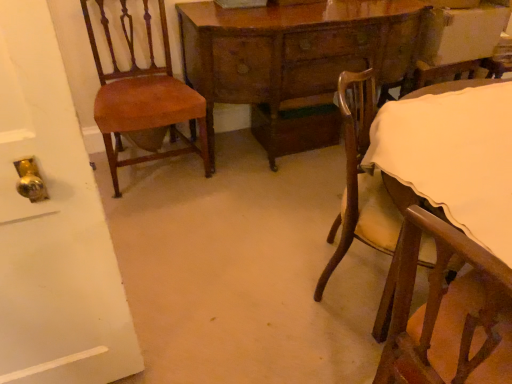
Question: Can you confirm if mahogany wood chair at left, which ranks as the 2th chair in right-to-left order, is positioned to the right of wooden table at center?

Choices:
 (A) yes
 (B) no

Answer: (B)

Question: From the image's perspective, would you say mahogany wood chair at left, which ranks as the 2th chair in right-to-left order, is shown under wooden table at center?

Choices:
 (A) no
 (B) yes

Answer: (B)

Question: Could you tell me if mahogany wood chair at left, which ranks as the 2th chair in right-to-left order, is facing wooden table at center?

Choices:
 (A) yes
 (B) no

Answer: (B)

Question: Does mahogany wood chair at left, which ranks as the first chair in left-to-right order, have a larger size compared to wooden table at center?

Choices:
 (A) no
 (B) yes

Answer: (A)

Question: Is mahogany wood chair at left, which ranks as the first chair in left-to-right order, thinner than wooden table at center?

Choices:
 (A) no
 (B) yes

Answer: (B)

Question: In terms of width, does mahogany wood chair at left, which ranks as the 2th chair in right-to-left order, look wider or thinner when compared to wooden chair with cream cushion at lower right, which is counted as the second chair, starting from the left?

Choices:
 (A) wide
 (B) thin

Answer: (B)

Question: Is mahogany wood chair at left, which ranks as the first chair in left-to-right order, inside the boundaries of wooden chair with cream cushion at lower right, which is counted as the second chair, starting from the left, or outside?

Choices:
 (A) inside
 (B) outside

Answer: (B)

Question: Is point (150, 26) positioned closer to the camera than point (468, 79)?

Choices:
 (A) farther
 (B) closer

Answer: (A)

Question: From the image's perspective, is mahogany wood chair at left, which ranks as the 2th chair in right-to-left order, located above or below wooden chair with cream cushion at lower right, which is counted as the second chair, starting from the left?

Choices:
 (A) above
 (B) below

Answer: (A)

Question: Is wooden table at center bigger or smaller than mahogany wood chair at left, which ranks as the first chair in left-to-right order?

Choices:
 (A) small
 (B) big

Answer: (B)

Question: In the image, is wooden table at center positioned in front of or behind mahogany wood chair at left, which ranks as the 2th chair in right-to-left order?

Choices:
 (A) behind
 (B) front

Answer: (A)

Question: Is point (372, 52) closer or farther from the camera than point (159, 74)?

Choices:
 (A) closer
 (B) farther

Answer: (A)

Question: Is wooden table at center spatially inside mahogany wood chair at left, which ranks as the 2th chair in right-to-left order, or outside of it?

Choices:
 (A) outside
 (B) inside

Answer: (A)

Question: In terms of width, does wooden table at center look wider or thinner when compared to wooden chair with cream cushion at lower right, which ranks as the 1th chair in right-to-left order?

Choices:
 (A) wide
 (B) thin

Answer: (B)

Question: From the image's perspective, is wooden table at center located above or below wooden chair with cream cushion at lower right, which is counted as the second chair, starting from the left?

Choices:
 (A) above
 (B) below

Answer: (A)